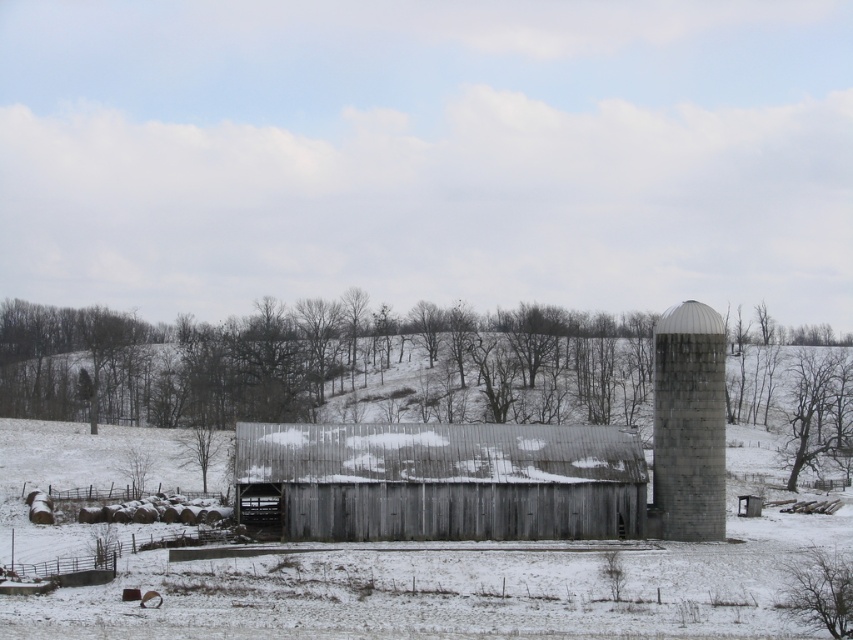
Who is positioned more to the right, weathered wood barn at center or gray concrete silo at right?

Positioned to the right is gray concrete silo at right.

Is weathered wood barn at center to the left of gray concrete silo at right from the viewer's perspective?

Yes, weathered wood barn at center is to the left of gray concrete silo at right.

Is point (474, 518) farther from camera compared to point (653, 476)?

No, it is in front of (653, 476).

Where is `weathered wood barn at center`? This screenshot has width=853, height=640. weathered wood barn at center is located at coordinates (440, 481).